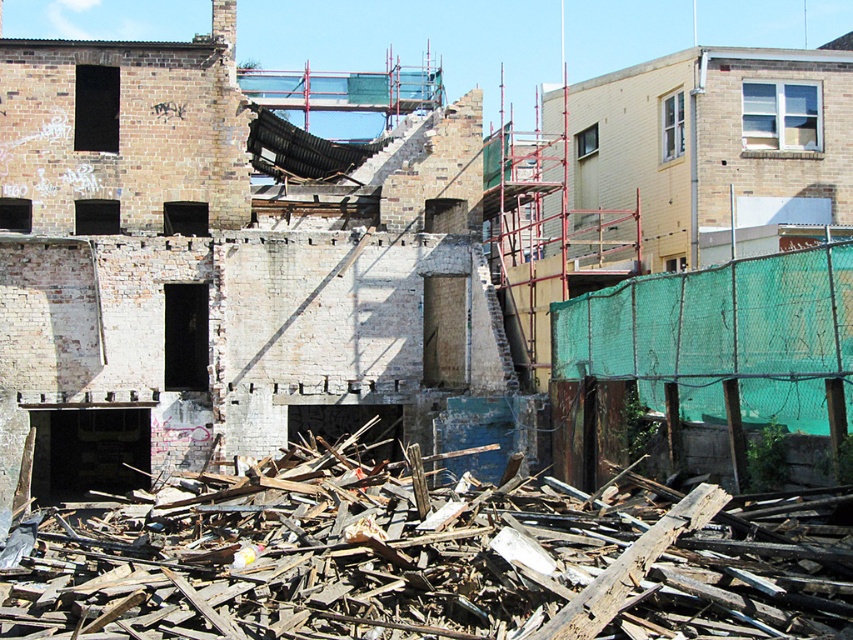
Question: Is brick wall at left smaller than wooden debris at lower center?

Choices:
 (A) no
 (B) yes

Answer: (A)

Question: Which point is closer to the camera?

Choices:
 (A) (161, 307)
 (B) (581, 536)

Answer: (B)

Question: Is brick wall at left smaller than wooden debris at lower center?

Choices:
 (A) yes
 (B) no

Answer: (B)

Question: Does brick wall at left have a larger size compared to wooden debris at lower center?

Choices:
 (A) no
 (B) yes

Answer: (B)